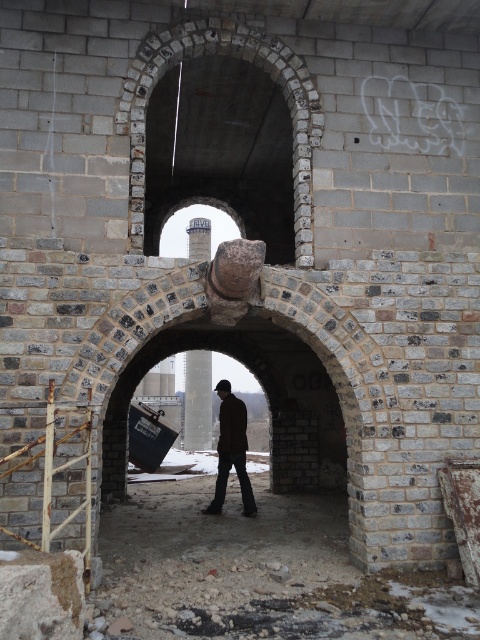
Question: Is brick stone archway at upper center below brown leather jacket at center?

Choices:
 (A) no
 (B) yes

Answer: (A)

Question: Is brick stone archway at upper center to the right of brown leather jacket at center from the viewer's perspective?

Choices:
 (A) no
 (B) yes

Answer: (B)

Question: Which object is farther from the camera taking this photo?

Choices:
 (A) brick stone archway at upper center
 (B) brown leather jacket at center

Answer: (B)

Question: Is brick stone archway at upper center positioned before brown leather jacket at center?

Choices:
 (A) yes
 (B) no

Answer: (A)

Question: Which point appears closest to the camera in this image?

Choices:
 (A) (227, 456)
 (B) (136, 225)

Answer: (B)